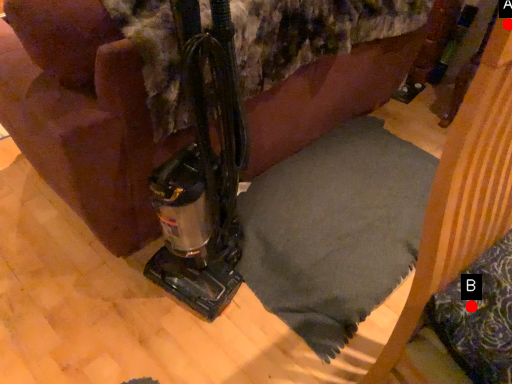
Question: Two points are circled on the image, labeled by A and B beside each circle. Which point is closer to the camera?

Choices:
 (A) A is closer
 (B) B is closer

Answer: (A)